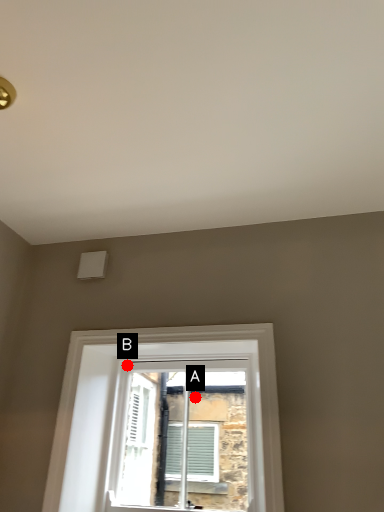
Question: Two points are circled on the image, labeled by A and B beside each circle. Among these points, which one is nearest to the camera?

Choices:
 (A) A is closer
 (B) B is closer

Answer: (B)